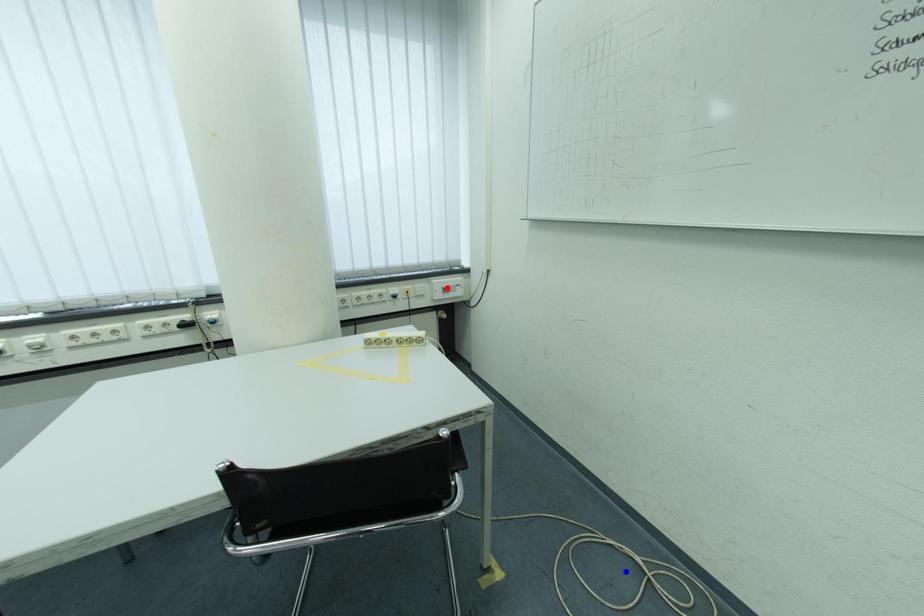
Question: In the image, two points are highlighted. Which point is nearer to the camera? Reply with the corresponding letter.

Choices:
 (A) blue point
 (B) red point

Answer: (A)